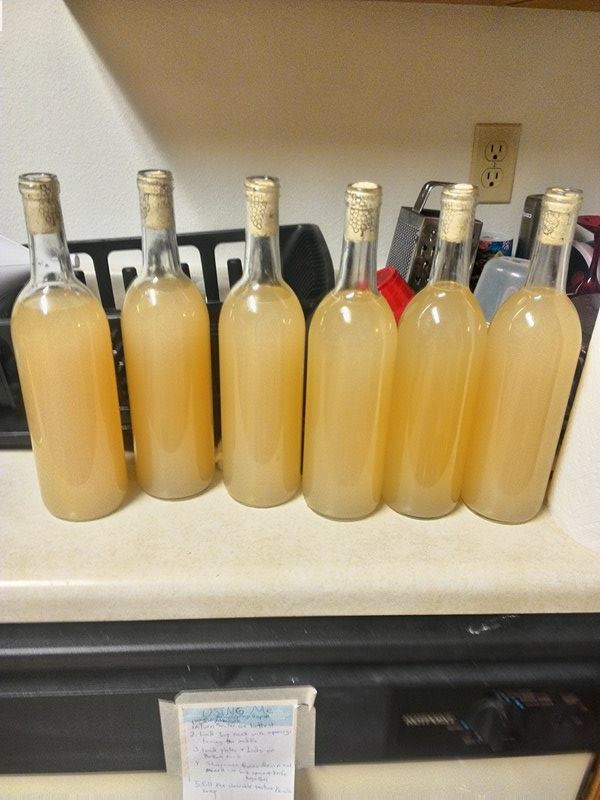
Locate an element on the screen. This screenshot has height=800, width=600. wine bottles is located at coordinates (43, 258), (156, 260), (259, 254), (357, 262), (446, 262), (543, 265).